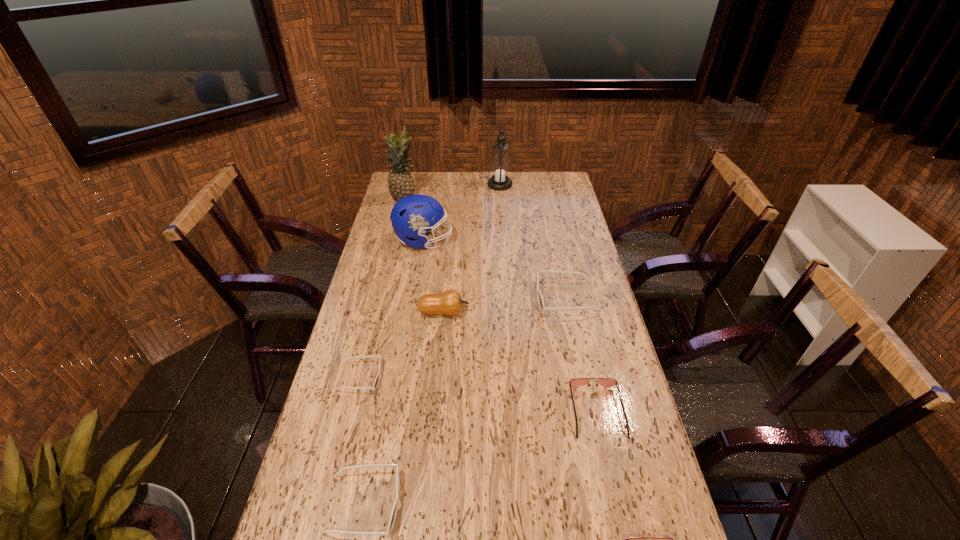
Image resolution: width=960 pixels, height=540 pixels. I want to click on free point between the smallest black sunglasses and the farthest sunglasses, so click(x=463, y=338).

Where is `object that stands as the third closest to the fourth tallest object`? The height and width of the screenshot is (540, 960). object that stands as the third closest to the fourth tallest object is located at coordinates (412, 216).

Locate which object ranks fifth in proximity to the sixth object from left to right. Please provide its 2D coordinates. Your answer should be formatted as a tuple, i.e. [(x, y)], where the tuple contains the x and y coordinates of a point satisfying the conditions above.

[(376, 381)]

Identify which sunglasses is the second closest to the green pineapple. Please provide its 2D coordinates. Your answer should be formatted as a tuple, i.e. [(x, y)], where the tuple contains the x and y coordinates of a point satisfying the conditions above.

[(376, 381)]

Identify which sunglasses is the third closest to the second biggest black sunglasses. Please provide its 2D coordinates. Your answer should be formatted as a tuple, i.e. [(x, y)], where the tuple contains the x and y coordinates of a point satisfying the conditions above.

[(658, 539)]

Select which black sunglasses appears as the third closest to the third farthest object. Please provide its 2D coordinates. Your answer should be formatted as a tuple, i.e. [(x, y)], where the tuple contains the x and y coordinates of a point satisfying the conditions above.

[(394, 510)]

The width and height of the screenshot is (960, 540). I want to click on black sunglasses that is the third nearest to the sixth object from left to right, so click(x=394, y=510).